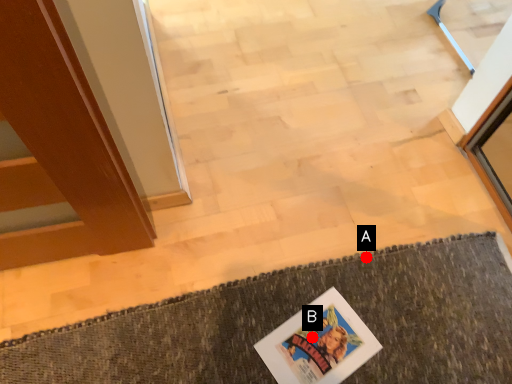
Question: Two points are circled on the image, labeled by A and B beside each circle. Which point is farther from the camera taking this photo?

Choices:
 (A) A is further
 (B) B is further

Answer: (A)